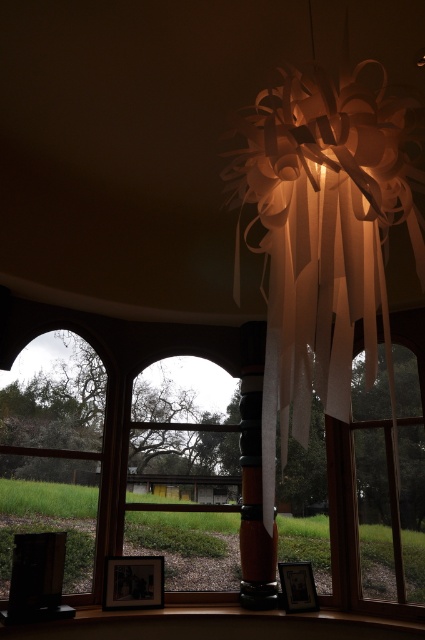
Question: Does wooden at lower center lie in front of matte black picture frame at lower left?

Choices:
 (A) no
 (B) yes

Answer: (B)

Question: Which point is closer to the camera?

Choices:
 (A) clear glass window at left
 (B) matte black picture frame at lower center
 (C) clear glass window at center

Answer: (A)

Question: Where is transparent plastic ribbons at upper center located in relation to matte black picture frame at lower left in the image?

Choices:
 (A) right
 (B) left

Answer: (B)

Question: Can you confirm if clear glass window at left is positioned below matte black picture frame at lower left?

Choices:
 (A) no
 (B) yes

Answer: (A)

Question: Which point is closer to the camera taking this photo?

Choices:
 (A) (348, 572)
 (B) (393, 529)
 (C) (291, 604)

Answer: (C)

Question: Estimate the real-world distances between objects in this image. Which object is farther from the wooden at lower center?

Choices:
 (A) matte black picture frame at lower left
 (B) clear glass window at left
 (C) matte black picture frame at lower center
 (D) transparent plastic ribbons at upper center

Answer: (D)